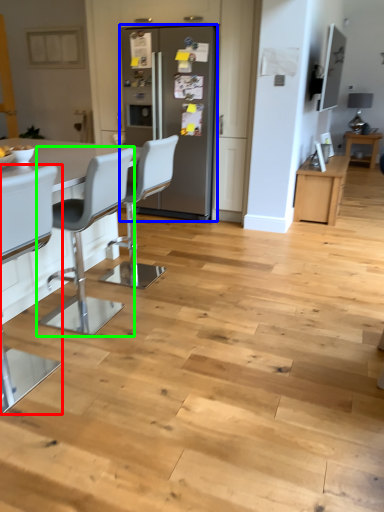
Question: Based on their relative distances, which object is nearer to chair (highlighted by a red box)? Choose from fridge (highlighted by a blue box) and chair (highlighted by a green box).

Choices:
 (A) fridge
 (B) chair

Answer: (B)